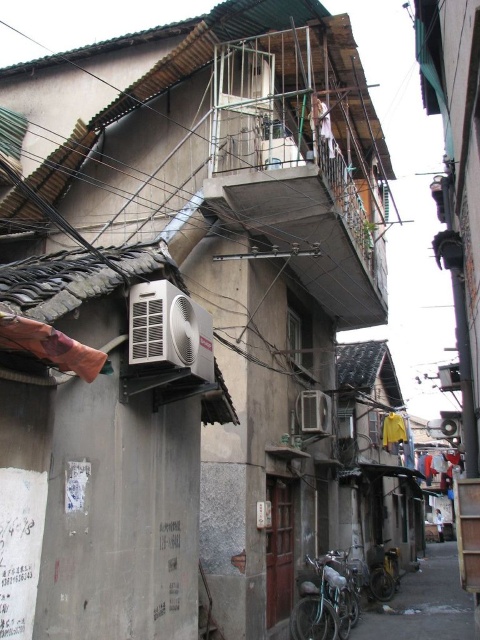
Image resolution: width=480 pixels, height=640 pixels. Find the location of `silver metallic air conditioner at center`. silver metallic air conditioner at center is located at coordinates (169, 328).

Who is higher up, silver metallic air conditioner at center or white plastic air conditioner at upper center?

silver metallic air conditioner at center is above.

Who is more distant from viewer, (179, 333) or (444, 385)?

Point (444, 385)

Where is `silver metallic air conditioner at center`? The image size is (480, 640). silver metallic air conditioner at center is located at coordinates (169, 328).

Between white plastic air conditioner at lower right and white plastic air conditioner at upper center, which one has more height?

white plastic air conditioner at upper center

Is point (298, 406) positioned before point (456, 385)?

No, (298, 406) is behind (456, 385).

Find the location of a particular element. white plastic air conditioner at lower right is located at coordinates (313, 412).

Which of these two, silver metallic air conditioner at center or white plastic air conditioner at lower right, stands taller?

Standing taller between the two is silver metallic air conditioner at center.

Is silver metallic air conditioner at center thinner than white plastic air conditioner at lower right?

Correct, silver metallic air conditioner at center's width is less than white plastic air conditioner at lower right's.

Is point (136, 285) positioned after point (326, 426)?

That is False.

Where is `silver metallic air conditioner at center`? The height and width of the screenshot is (640, 480). silver metallic air conditioner at center is located at coordinates (169, 328).